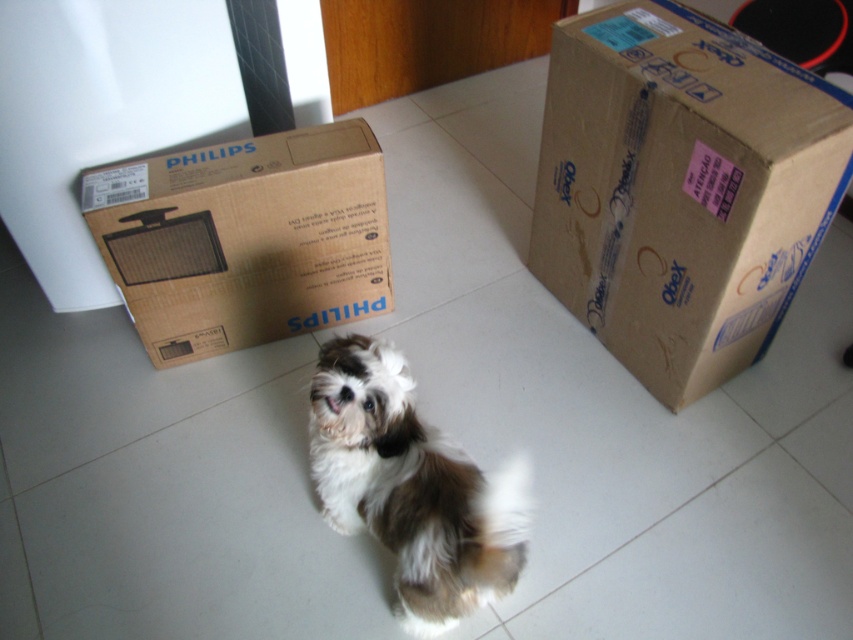
Is the position of brown cardboard box at upper right less distant than that of brown cardboard box at upper left?

Yes, brown cardboard box at upper right is in front of brown cardboard box at upper left.

Between point (711, 204) and point (165, 310), which one is positioned behind?

Positioned behind is point (165, 310).

Image resolution: width=853 pixels, height=640 pixels. I want to click on brown cardboard box at upper right, so click(x=682, y=188).

Is brown cardboard box at upper left in front of fluffy white dog at center?

No, it is behind fluffy white dog at center.

Is brown cardboard box at upper left taller than fluffy white dog at center?

Incorrect, brown cardboard box at upper left's height is not larger of fluffy white dog at center's.

I want to click on brown cardboard box at upper left, so point(245,237).

You are a GUI agent. You are given a task and a screenshot of the screen. Output one action in this format:
    pyautogui.click(x=<x>, y=<y>)
    Task: Click on the brown cardboard box at upper left
    The height and width of the screenshot is (640, 853).
    Given the screenshot: What is the action you would take?
    pyautogui.click(x=245, y=237)

Can you confirm if brown cardboard box at upper right is wider than fluffy white dog at center?

Indeed, brown cardboard box at upper right has a greater width compared to fluffy white dog at center.

Does brown cardboard box at upper right appear on the right side of fluffy white dog at center?

Yes, brown cardboard box at upper right is to the right of fluffy white dog at center.

In order to click on brown cardboard box at upper right in this screenshot , I will do `click(682, 188)`.